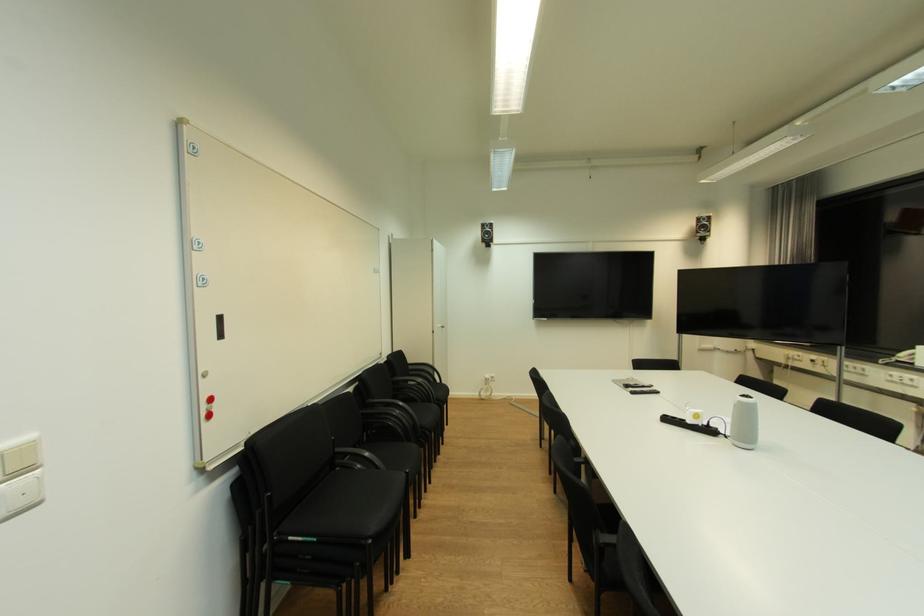
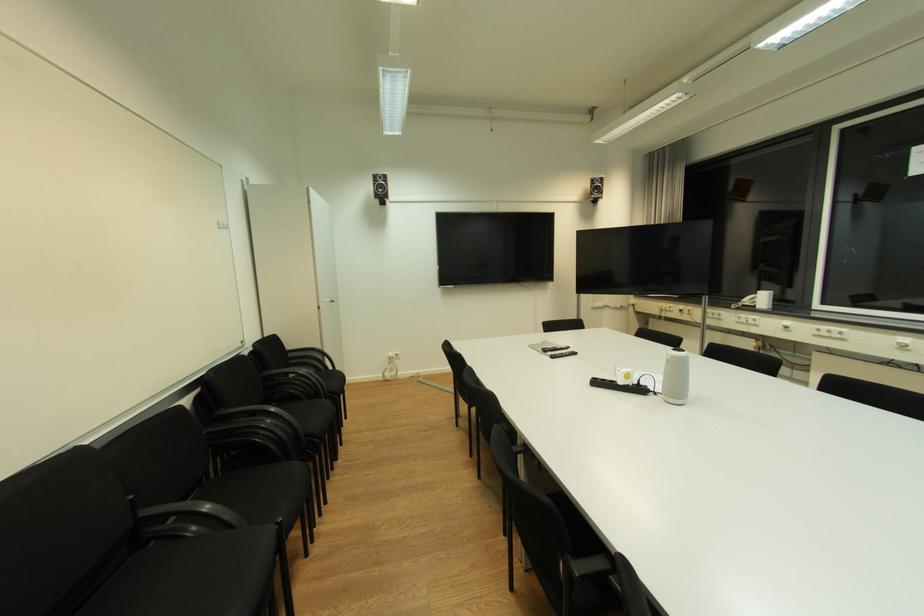
Find the pixel in the second image that matches [338,439] in the first image.

(137, 498)